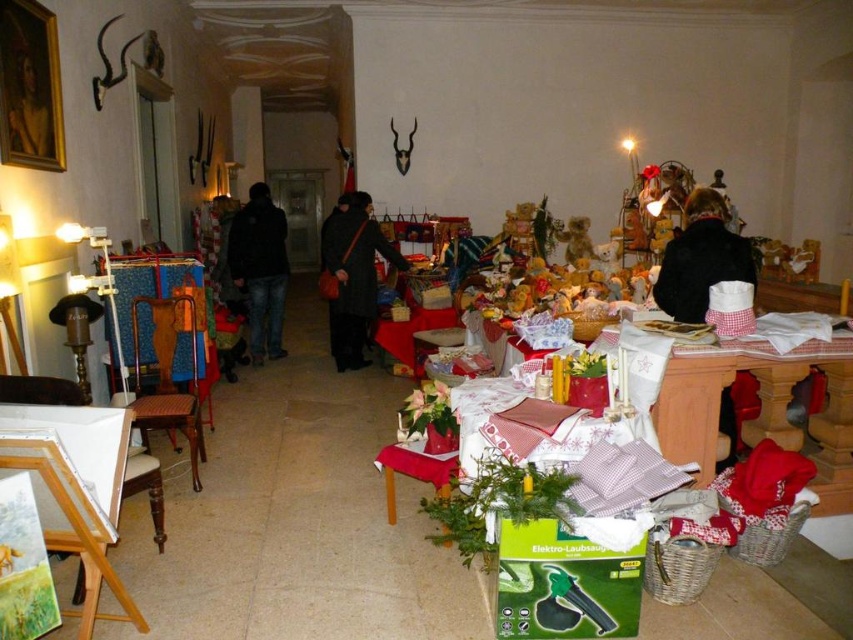
You are standing in the room and want to place a small potted plant on the red checkered tablecloth at lower right. The tablecloth is positioned at coordinates point [759,406]. Can you confirm the exact location of the red checkered tablecloth at lower right based on the coordinates provided?

The red checkered tablecloth at lower right is located at coordinates point [759,406] as specified.

You are a guest in this room and want to place a small potted plant on the red checkered tablecloth at lower right. However, there is a dark wool coat at center in the way. Can you place the plant on the tablecloth without moving the coat?

The red checkered tablecloth at lower right is in front of the dark wool coat at center, so you can place the plant on the tablecloth without moving the coat because the tablecloth is closer to you than the coat.